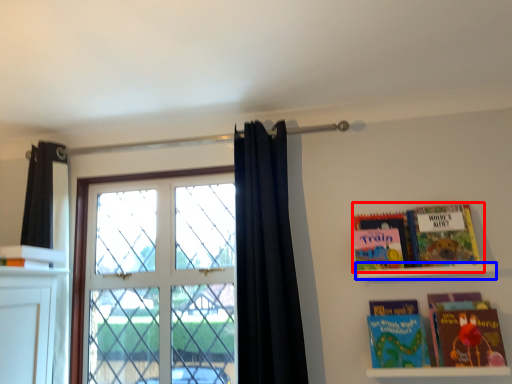
Question: Among these objects, which one is nearest to the camera, book (highlighted by a red box) or shelf (highlighted by a blue box)?

Choices:
 (A) book
 (B) shelf

Answer: (B)